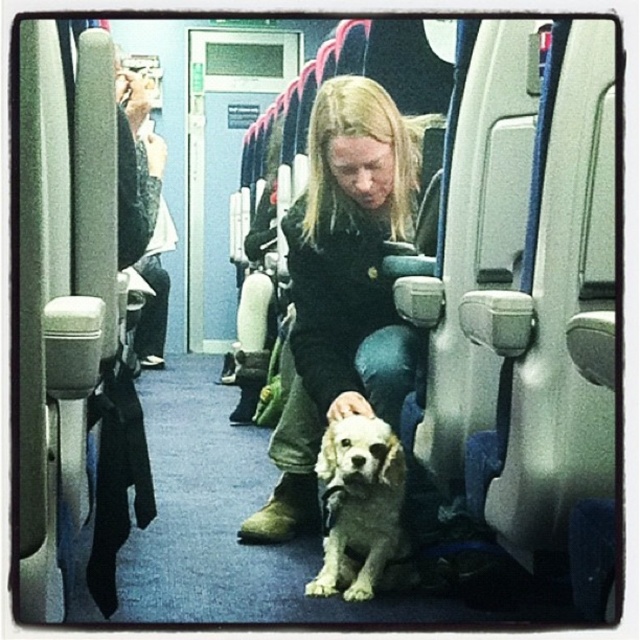
You are a passenger on the train and want to place your backpack on the seat next to the matte black jacket at center. Is there enough space for your backpack?

There is no information provided about the size of the backpack or the available space next to the matte black jacket at center, so it is impossible to determine if there is enough space.

You are a passenger on a train and you see the matte black jacket at center and the white fur dog at center. Which object is covering the other?

The matte black jacket at center is positioned over white fur dog at center, so the jacket is covering the dog.

You are a passenger on the train and want to let the white fur dog at center move forward. Is the matte black jacket at center blocking its path?

The matte black jacket at center is in front of the white fur dog at center, so yes, the matte black jacket at center is blocking its path.